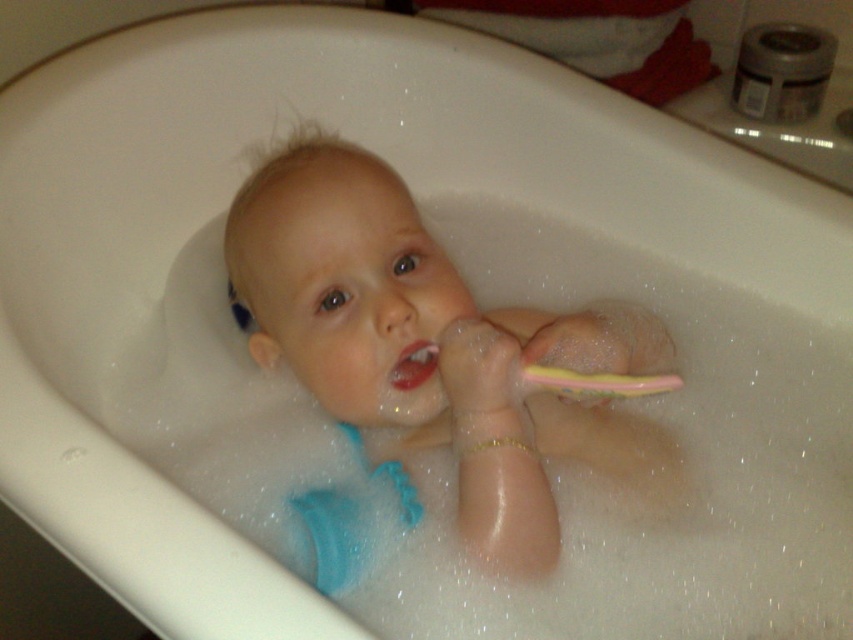
Can you confirm if smooth plastic toothbrush at center is positioned to the left of pink rubber toothbrush at upper center?

In fact, smooth plastic toothbrush at center is to the right of pink rubber toothbrush at upper center.

Between smooth plastic toothbrush at center and pink rubber toothbrush at upper center, which one has more height?

With more height is smooth plastic toothbrush at center.

Who is more forward, [244,292] or [428,356]?

Point [428,356] is more forward.

You are a GUI agent. You are given a task and a screenshot of the screen. Output one action in this format:
    pyautogui.click(x=<x>, y=<y>)
    Task: Click on the smooth plastic toothbrush at center
    
    Given the screenshot: What is the action you would take?
    pyautogui.click(x=432, y=340)

Is smooth plastic toothbrush at center positioned behind yellow rubber toothbrush at upper center?

That is True.

Is point (372, 259) positioned behind point (593, 378)?

Yes, it is.

Locate an element on the screen. Image resolution: width=853 pixels, height=640 pixels. smooth plastic toothbrush at center is located at coordinates (432, 340).

I want to click on smooth plastic toothbrush at center, so click(432, 340).

Is yellow rubber toothbrush at upper center in front of pink rubber toothbrush at upper center?

Yes.

Which is more to the left, yellow rubber toothbrush at upper center or pink rubber toothbrush at upper center?

pink rubber toothbrush at upper center

What do you see at coordinates (596, 381) in the screenshot? The image size is (853, 640). I see `yellow rubber toothbrush at upper center` at bounding box center [596, 381].

I want to click on yellow rubber toothbrush at upper center, so click(596, 381).